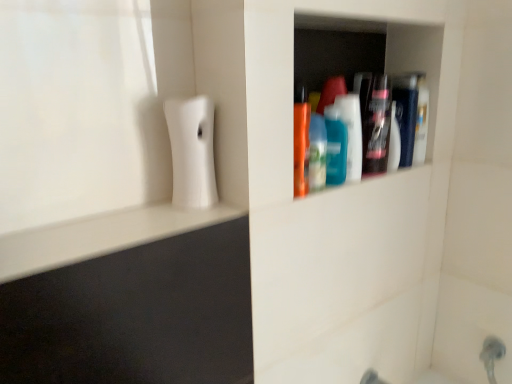
You are a GUI agent. You are given a task and a screenshot of the screen. Output one action in this format:
    pyautogui.click(x=<x>, y=<y>)
    Task: Click on the translucent plastic mouthwash at upper right, the third mouthwash when ordered from left to right
    This screenshot has height=384, width=512.
    Given the screenshot: What is the action you would take?
    pyautogui.click(x=406, y=114)

Image resolution: width=512 pixels, height=384 pixels. I want to click on mouthwash located above the teal glossy mouthwash at center, the second mouthwash when ordered from left to right (from the image's perspective), so pos(406,114).

In terms of height, does translucent plastic mouthwash at upper right, the third mouthwash when ordered from left to right, look taller or shorter compared to teal glossy mouthwash at center, the second mouthwash when ordered from left to right?

Considering their sizes, translucent plastic mouthwash at upper right, the third mouthwash when ordered from left to right, has more height than teal glossy mouthwash at center, the second mouthwash when ordered from left to right.

Is translucent plastic mouthwash at upper right, the third mouthwash when ordered from left to right, wider than teal glossy mouthwash at center, the second mouthwash when ordered from left to right?

Indeed, translucent plastic mouthwash at upper right, the third mouthwash when ordered from left to right, has a greater width compared to teal glossy mouthwash at center, the second mouthwash when ordered from left to right.

Who is shorter, translucent plastic mouthwash at upper right, placed as the 1th mouthwash when sorted from right to left, or translucent blue bottle at center, placed as the 1th mouthwash when sorted from left to right?

translucent blue bottle at center, placed as the 1th mouthwash when sorted from left to right, is shorter.

From the image's perspective, is translucent plastic mouthwash at upper right, placed as the 1th mouthwash when sorted from right to left, below translucent blue bottle at center, placed as the 1th mouthwash when sorted from left to right?

No.

In the scene shown: Is translucent plastic mouthwash at upper right, placed as the 1th mouthwash when sorted from right to left, beside translucent blue bottle at center, positioned as the third mouthwash in right-to-left order?

No, translucent plastic mouthwash at upper right, placed as the 1th mouthwash when sorted from right to left, is not with translucent blue bottle at center, positioned as the third mouthwash in right-to-left order.

From a real-world perspective, is translucent plastic mouthwash at upper right, placed as the 1th mouthwash when sorted from right to left, located higher than translucent blue bottle at center, positioned as the third mouthwash in right-to-left order?

Yes, from a real-world perspective, translucent plastic mouthwash at upper right, placed as the 1th mouthwash when sorted from right to left, is over translucent blue bottle at center, positioned as the third mouthwash in right-to-left order

Is translucent blue bottle at center, placed as the 1th mouthwash when sorted from left to right, smaller than translucent plastic mouthwash at upper right, placed as the 1th mouthwash when sorted from right to left?

Yes, translucent blue bottle at center, placed as the 1th mouthwash when sorted from left to right, is smaller than translucent plastic mouthwash at upper right, placed as the 1th mouthwash when sorted from right to left.

Is the surface of translucent blue bottle at center, placed as the 1th mouthwash when sorted from left to right, in direct contact with translucent plastic mouthwash at upper right, placed as the 1th mouthwash when sorted from right to left?

No, translucent blue bottle at center, placed as the 1th mouthwash when sorted from left to right, is not beside translucent plastic mouthwash at upper right, placed as the 1th mouthwash when sorted from right to left.

Is translucent blue bottle at center, placed as the 1th mouthwash when sorted from left to right, facing away from translucent plastic mouthwash at upper right, placed as the 1th mouthwash when sorted from right to left?

No, translucent plastic mouthwash at upper right, placed as the 1th mouthwash when sorted from right to left, is not at the back of translucent blue bottle at center, placed as the 1th mouthwash when sorted from left to right.

Does teal glossy mouthwash at center, which is the 2th mouthwash in right-to-left order, come in front of translucent plastic mouthwash at upper right, placed as the 1th mouthwash when sorted from right to left?

Yes, it is.

Can we say teal glossy mouthwash at center, the second mouthwash when ordered from left to right, lies outside translucent plastic mouthwash at upper right, placed as the 1th mouthwash when sorted from right to left?

Indeed, teal glossy mouthwash at center, the second mouthwash when ordered from left to right, is completely outside translucent plastic mouthwash at upper right, placed as the 1th mouthwash when sorted from right to left.

The height and width of the screenshot is (384, 512). What are the coordinates of `mouthwash located above the teal glossy mouthwash at center, the second mouthwash when ordered from left to right (from a real-world perspective)` in the screenshot? It's located at (406, 114).

From the picture: Is teal glossy mouthwash at center, which is the 2th mouthwash in right-to-left order, placed right next to translucent plastic mouthwash at upper right, placed as the 1th mouthwash when sorted from right to left?

teal glossy mouthwash at center, which is the 2th mouthwash in right-to-left order, and translucent plastic mouthwash at upper right, placed as the 1th mouthwash when sorted from right to left, are clearly separated.

Is translucent blue bottle at center, placed as the 1th mouthwash when sorted from left to right, facing away from teal glossy mouthwash at center, the second mouthwash when ordered from left to right?

No, translucent blue bottle at center, placed as the 1th mouthwash when sorted from left to right, is not facing the opposite direction of teal glossy mouthwash at center, the second mouthwash when ordered from left to right.

Is translucent blue bottle at center, positioned as the third mouthwash in right-to-left order, wider or thinner than teal glossy mouthwash at center, the second mouthwash when ordered from left to right?

Considering their sizes, translucent blue bottle at center, positioned as the third mouthwash in right-to-left order, looks broader than teal glossy mouthwash at center, the second mouthwash when ordered from left to right.

Can teal glossy mouthwash at center, the second mouthwash when ordered from left to right, be found inside translucent blue bottle at center, placed as the 1th mouthwash when sorted from left to right?

No, teal glossy mouthwash at center, the second mouthwash when ordered from left to right, is not inside translucent blue bottle at center, placed as the 1th mouthwash when sorted from left to right.

Is translucent blue bottle at center, placed as the 1th mouthwash when sorted from left to right, next to teal glossy mouthwash at center, which is the 2th mouthwash in right-to-left order?

Indeed, translucent blue bottle at center, placed as the 1th mouthwash when sorted from left to right, and teal glossy mouthwash at center, which is the 2th mouthwash in right-to-left order, are beside each other and touching.

Can you confirm if teal glossy mouthwash at center, which is the 2th mouthwash in right-to-left order, is thinner than translucent blue bottle at center, positioned as the third mouthwash in right-to-left order?

Yes.

Is teal glossy mouthwash at center, which is the 2th mouthwash in right-to-left order, spatially inside translucent blue bottle at center, positioned as the third mouthwash in right-to-left order, or outside of it?

teal glossy mouthwash at center, which is the 2th mouthwash in right-to-left order, cannot be found inside translucent blue bottle at center, positioned as the third mouthwash in right-to-left order.

From a real-world perspective, is teal glossy mouthwash at center, which is the 2th mouthwash in right-to-left order, above or below translucent blue bottle at center, positioned as the third mouthwash in right-to-left order?

teal glossy mouthwash at center, which is the 2th mouthwash in right-to-left order, is above translucent blue bottle at center, positioned as the third mouthwash in right-to-left order.

Where is `the 1st mouthwash counting from the right of the translucent blue bottle at center, placed as the 1th mouthwash when sorted from left to right`? The width and height of the screenshot is (512, 384). the 1st mouthwash counting from the right of the translucent blue bottle at center, placed as the 1th mouthwash when sorted from left to right is located at coordinates (352, 133).

From a real-world perspective, starting from the translucent plastic mouthwash at upper right, the third mouthwash when ordered from left to right, which mouthwash is the 1st one below it? Please provide its 2D coordinates.

[(352, 133)]

There is a translucent blue bottle at center, placed as the 1th mouthwash when sorted from left to right. At what (x,y) coordinates should I click in order to perform the action: click on the 2nd mouthwash above it (from the image's perspective). Please return your answer as a coordinate pair (x, y). Image resolution: width=512 pixels, height=384 pixels. Looking at the image, I should click on (406, 114).

Considering their positions, is translucent plastic mouthwash at upper right, placed as the 1th mouthwash when sorted from right to left, positioned closer to teal glossy mouthwash at center, the second mouthwash when ordered from left to right, than translucent blue bottle at center, positioned as the third mouthwash in right-to-left order?

Based on the image, translucent blue bottle at center, positioned as the third mouthwash in right-to-left order, appears to be nearer to teal glossy mouthwash at center, the second mouthwash when ordered from left to right.

Looking at the image, which one is located further to translucent blue bottle at center, positioned as the third mouthwash in right-to-left order, teal glossy mouthwash at center, the second mouthwash when ordered from left to right, or translucent plastic mouthwash at upper right, placed as the 1th mouthwash when sorted from right to left?

translucent plastic mouthwash at upper right, placed as the 1th mouthwash when sorted from right to left, lies further to translucent blue bottle at center, positioned as the third mouthwash in right-to-left order, than the other object.

Estimate the real-world distances between objects in this image. Which object is further from translucent blue bottle at center, placed as the 1th mouthwash when sorted from left to right, translucent plastic mouthwash at upper right, the third mouthwash when ordered from left to right, or teal glossy mouthwash at center, the second mouthwash when ordered from left to right?

translucent plastic mouthwash at upper right, the third mouthwash when ordered from left to right, is positioned further to the anchor translucent blue bottle at center, placed as the 1th mouthwash when sorted from left to right.

Considering their positions, is translucent blue bottle at center, placed as the 1th mouthwash when sorted from left to right, positioned closer to translucent plastic mouthwash at upper right, placed as the 1th mouthwash when sorted from right to left, than teal glossy mouthwash at center, the second mouthwash when ordered from left to right?

teal glossy mouthwash at center, the second mouthwash when ordered from left to right, lies closer to translucent plastic mouthwash at upper right, placed as the 1th mouthwash when sorted from right to left, than the other object.

When comparing their distances from translucent plastic mouthwash at upper right, the third mouthwash when ordered from left to right, does teal glossy mouthwash at center, the second mouthwash when ordered from left to right, or translucent blue bottle at center, positioned as the third mouthwash in right-to-left order, seem closer?

teal glossy mouthwash at center, the second mouthwash when ordered from left to right, is closer to translucent plastic mouthwash at upper right, the third mouthwash when ordered from left to right.

Estimate the real-world distances between objects in this image. Which object is closer to teal glossy mouthwash at center, the second mouthwash when ordered from left to right, translucent blue bottle at center, placed as the 1th mouthwash when sorted from left to right, or translucent plastic mouthwash at upper right, placed as the 1th mouthwash when sorted from right to left?

Based on the image, translucent blue bottle at center, placed as the 1th mouthwash when sorted from left to right, appears to be nearer to teal glossy mouthwash at center, the second mouthwash when ordered from left to right.

Locate an element on the screen. This screenshot has height=384, width=512. mouthwash between translucent blue bottle at center, placed as the 1th mouthwash when sorted from left to right, and translucent plastic mouthwash at upper right, placed as the 1th mouthwash when sorted from right to left, from left to right is located at coordinates (352, 133).